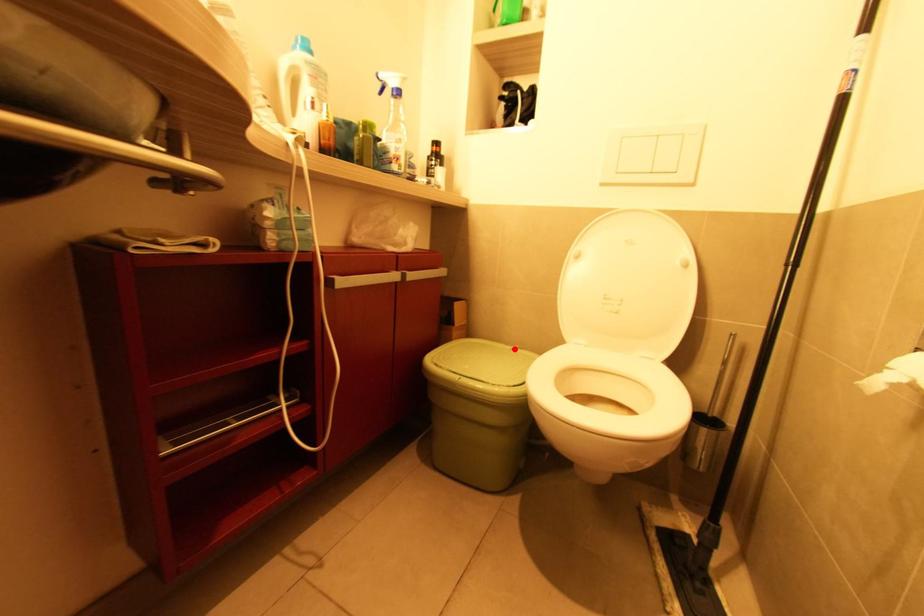
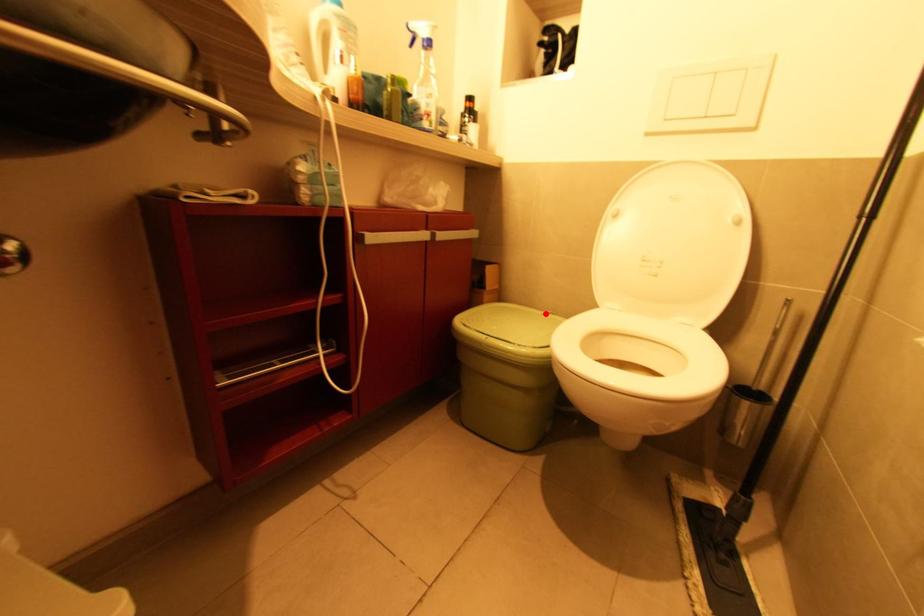
I am providing you with two images of the same scene from different viewpoints. A red point is marked on the first image and another point is marked on the second image. Is the marked point in image1 the same physical position as the marked point in image2?

Yes